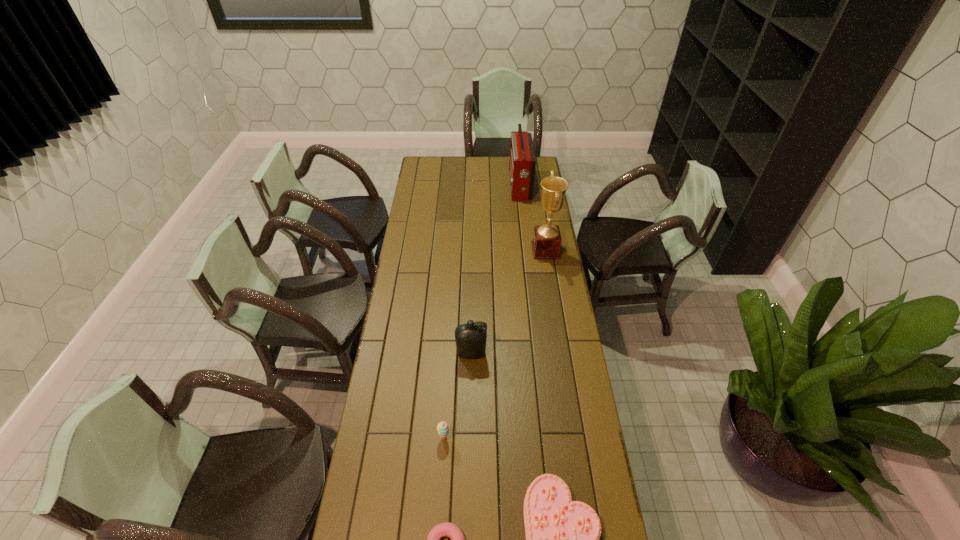
Locate an element on the screen. blank area located 0.120m on the plaque of the trophy cup is located at coordinates (508, 250).

Where is `vacant space located 0.150m on the front-facing side of the second tallest object`? The height and width of the screenshot is (540, 960). vacant space located 0.150m on the front-facing side of the second tallest object is located at coordinates (483, 186).

Where is `free location located 0.060m on the front-facing side of the second tallest object`? This screenshot has height=540, width=960. free location located 0.060m on the front-facing side of the second tallest object is located at coordinates (498, 186).

Find the location of a particular element. The height and width of the screenshot is (540, 960). free space located 0.130m on the front-facing side of the second tallest object is located at coordinates (487, 186).

At what (x,y) coordinates should I click in order to perform the action: click on vacant area located 0.290m on the left of the third tallest object. Please return your answer as a coordinate pair (x, y). Image resolution: width=960 pixels, height=540 pixels. Looking at the image, I should click on (383, 353).

Where is `vacant space located on the back of the sherbert`? Image resolution: width=960 pixels, height=540 pixels. vacant space located on the back of the sherbert is located at coordinates (447, 372).

Find the location of `object that is at the far edge`. object that is at the far edge is located at coordinates (522, 163).

I want to click on trophy cup located at the right edge, so click(x=546, y=244).

The image size is (960, 540). In order to click on radio receiver that is at the right edge in this screenshot , I will do `click(522, 163)`.

I want to click on object located in the far right corner section of the desktop, so click(522, 163).